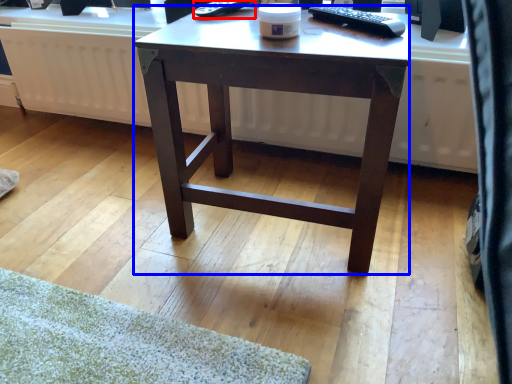
Question: Among these objects, which one is nearest to the camera, remote control (highlighted by a red box) or desk (highlighted by a blue box)?

Choices:
 (A) remote control
 (B) desk

Answer: (B)